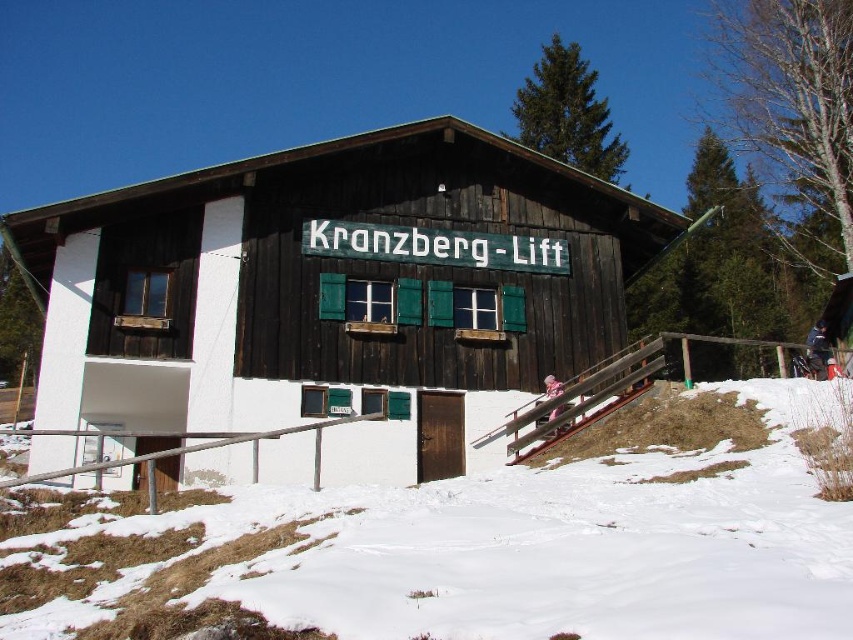
You are planning to set up a small winter market stall. You have a wooden cabin at center and a pink fabric at center available. Which object can accommodate more items based on their size?

The wooden cabin at center is bigger than the pink fabric at center, so it can accommodate more items.

You are standing in front of the Kranzberg Lift building during winter. You see a wooden cabin at center and a pink fabric at center. Which object is closer to you?

The wooden cabin at center is closer to you because it is in front of the pink fabric at center.

Consider the image. You are planning to build a small snowman using the white powdery snow at lower center. Considering the size of the wooden cabin at center, will you have enough snow to cover the entire base of the cabin?

The wooden cabin at center is larger in size compared to the white powdery snow at lower center, so there may not be enough snow to cover the entire base of the cabin.